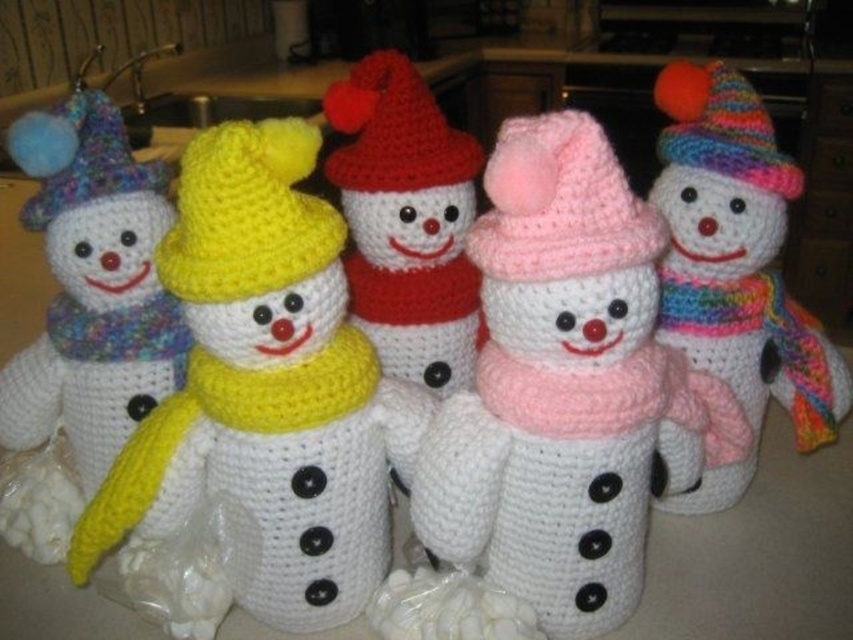
You are standing at the point marked by the coordinate point at point (x=786, y=381) and want to reach the kitchen sink located at the opposite end of the countertop. The path to the sink is blocked by the five crocheted snowmen arranged in a row. If each snowman is 26.45 inches apart, how many snowmen do you need to move to create a clear path to the sink?

Since the snowmen are arranged in a row with 26.45 inches between each, you would need to move all five snowmen to create a clear path to the sink. However, if the spacing between them allows you to navigate around without moving all, but the question specifies the path is blocked, so moving all ensures clearance.

You are holding a ruler that is 60 centimeters long. You want to measure the distance between yourself and the point at coordinates point (717, 451). Can your ruler reach that point?

The distance between point (717, 451) and the camera is 63.70 centimeters. Since your ruler is only 60 centimeters long, it cannot reach the point.